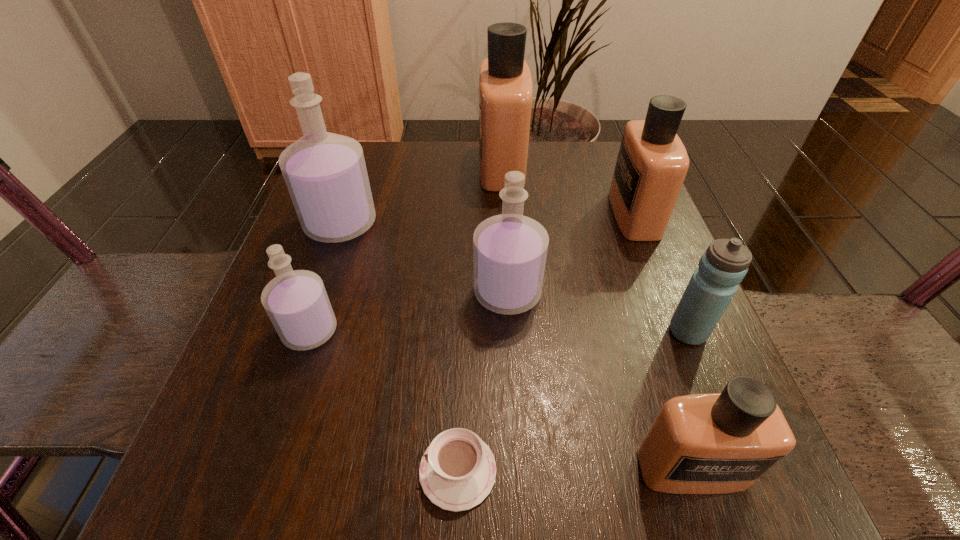
The height and width of the screenshot is (540, 960). I want to click on free space between the smallest beige perfume and the second biggest beige perfume, so click(x=662, y=341).

You are a GUI agent. You are given a task and a screenshot of the screen. Output one action in this format:
    pyautogui.click(x=<x>, y=<y>)
    Task: Click on the unoccupied position between the water bottle and the shortest object
    
    Given the screenshot: What is the action you would take?
    pyautogui.click(x=573, y=401)

Choose which object is the sixth nearest neighbor to the biggest purple perfume. Please provide its 2D coordinates. Your answer should be formatted as a tuple, i.e. [(x, y)], where the tuple contains the x and y coordinates of a point satisfying the conditions above.

[(724, 264)]

Identify which object is located as the second nearest to the second smallest purple perfume. Please provide its 2D coordinates. Your answer should be formatted as a tuple, i.e. [(x, y)], where the tuple contains the x and y coordinates of a point satisfying the conditions above.

[(457, 471)]

The width and height of the screenshot is (960, 540). In order to click on perfume that is the nearest to the leftmost beige perfume in this screenshot , I will do pos(652,163).

Image resolution: width=960 pixels, height=540 pixels. What are the coordinates of `perfume that stands as the fourth closest to the rightmost purple perfume` in the screenshot? It's located at (720, 443).

The width and height of the screenshot is (960, 540). I want to click on beige perfume that is the nearest to the rightmost purple perfume, so click(652, 163).

Find the location of a particular element. The image size is (960, 540). the closest beige perfume to the water bottle is located at coordinates (720, 443).

Identify which purple perfume is the third closest to the water bottle. Please provide its 2D coordinates. Your answer should be formatted as a tuple, i.e. [(x, y)], where the tuple contains the x and y coordinates of a point satisfying the conditions above.

[(325, 173)]

You are a GUI agent. You are given a task and a screenshot of the screen. Output one action in this format:
    pyautogui.click(x=<x>, y=<y>)
    Task: Click on the purple perfume identified as the third closest to the nearest perfume
    The image size is (960, 540).
    Given the screenshot: What is the action you would take?
    pyautogui.click(x=325, y=173)